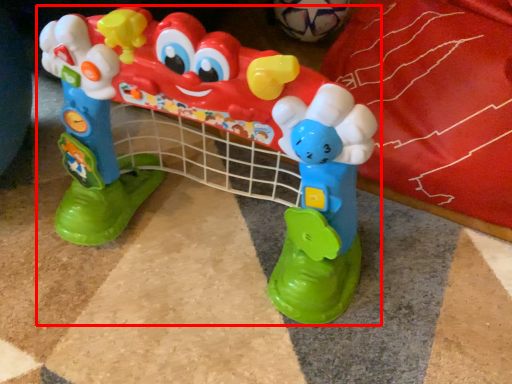
Question: From the image, what is the correct spatial relationship of toy (annotated by the red box) in relation to toy?

Choices:
 (A) right
 (B) left

Answer: (B)